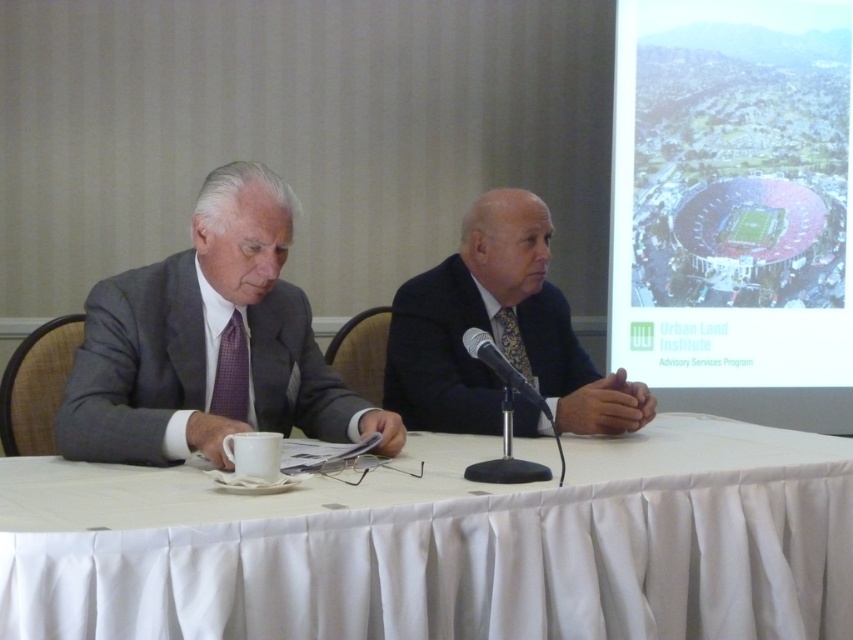
Looking at this image, can you confirm if dark blue suit at center is wider than plaid fabric tie at left?

Yes, dark blue suit at center is wider than plaid fabric tie at left.

Does dark blue suit at center appear on the right side of plaid fabric tie at left?

Correct, you'll find dark blue suit at center to the right of plaid fabric tie at left.

Does point (618, 390) lie in front of point (213, 376)?

That is False.

Image resolution: width=853 pixels, height=640 pixels. Identify the location of dark blue suit at center. (497, 332).

Is point (486, 600) in front of point (467, 349)?

Yes, it is.

Is point (39, 627) farther from viewer compared to point (550, 413)?

That is False.

Where is `white cloth at center`? white cloth at center is located at coordinates (447, 545).

Who is higher up, plaid fabric tie at left or black metallic microphone at center?

plaid fabric tie at left is higher up.

Measure the distance between plaid fabric tie at left and camera.

plaid fabric tie at left and camera are 1.90 meters apart.

Where is `plaid fabric tie at left`? plaid fabric tie at left is located at coordinates click(231, 372).